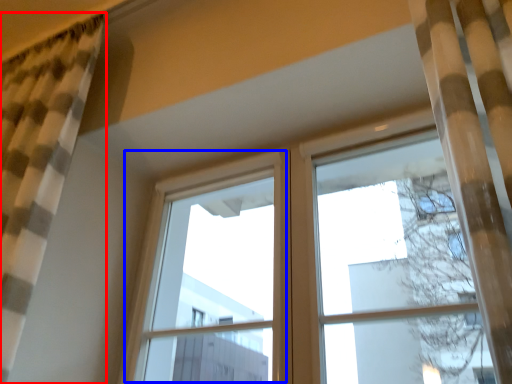
Question: Which point is further to the camera, curtain (highlighted by a red box) or window frame (highlighted by a blue box)?

Choices:
 (A) curtain
 (B) window frame

Answer: (B)